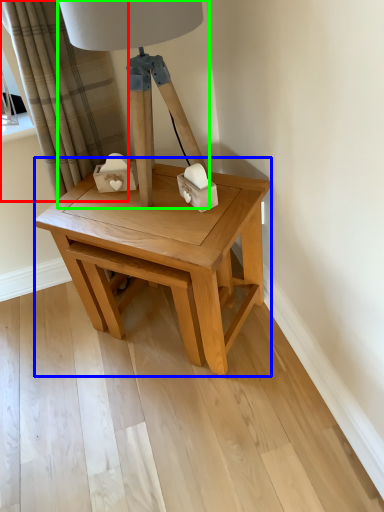
Question: Based on their relative distances, which object is farther from curtain (highlighted by a red box)? Choose from table (highlighted by a blue box) and table lamp (highlighted by a green box).

Choices:
 (A) table
 (B) table lamp

Answer: (A)